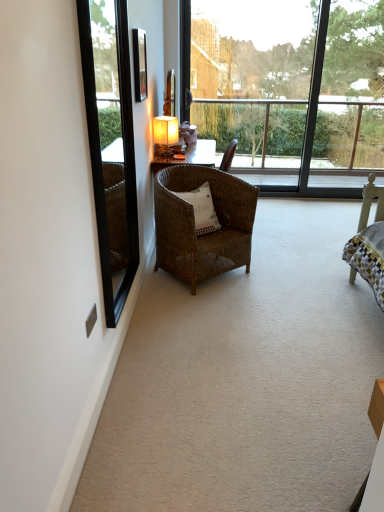
Identify the location of free spot in front of woven brown chair at center. The height and width of the screenshot is (512, 384). (216, 308).